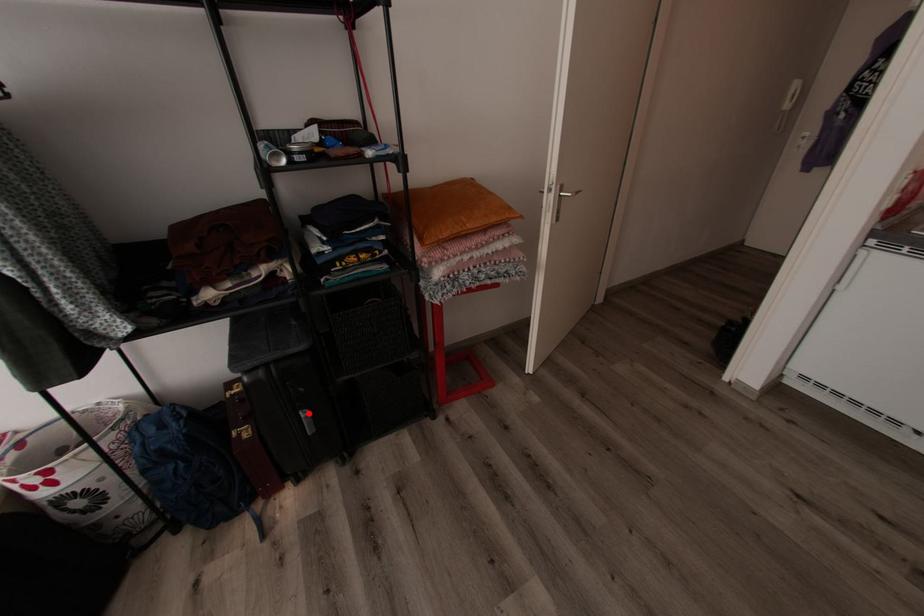
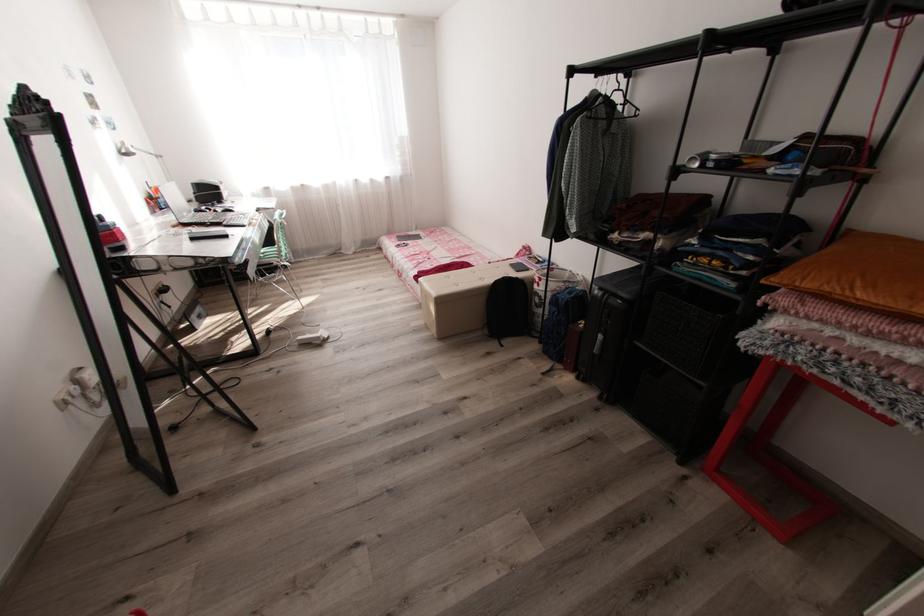
Find the pixel in the second image that matches the highlighted location in the first image.

(603, 336)